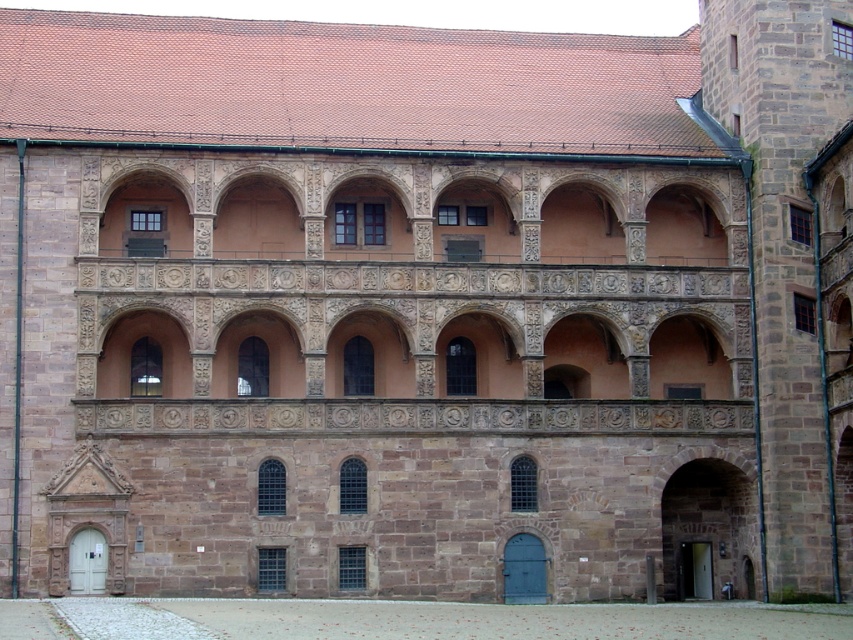
Describe the element at coordinates (412, 620) in the screenshot. Image resolution: width=853 pixels, height=640 pixels. I see `smooth gravel courtyard at lower center` at that location.

Does smooth gravel courtyard at lower center have a lesser height compared to stone archway at lower right?

No, smooth gravel courtyard at lower center is not shorter than stone archway at lower right.

This screenshot has height=640, width=853. What are the coordinates of `smooth gravel courtyard at lower center` in the screenshot? It's located at (412, 620).